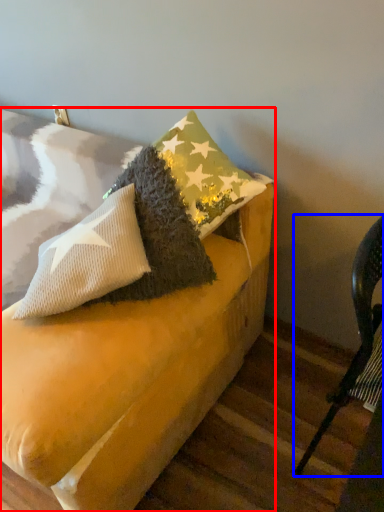
Question: Which point is further to the camera, furniture (highlighted by a red box) or chair (highlighted by a blue box)?

Choices:
 (A) furniture
 (B) chair

Answer: (A)